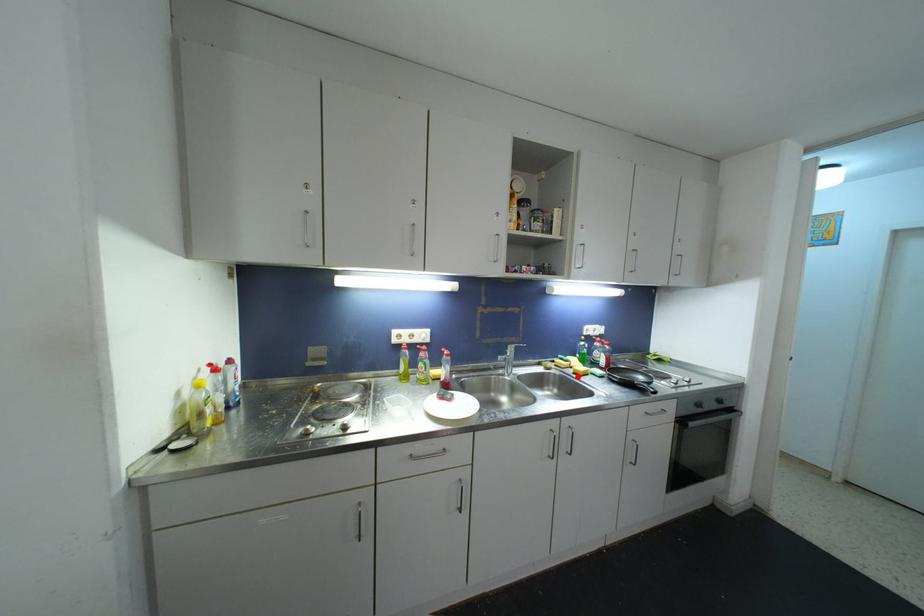
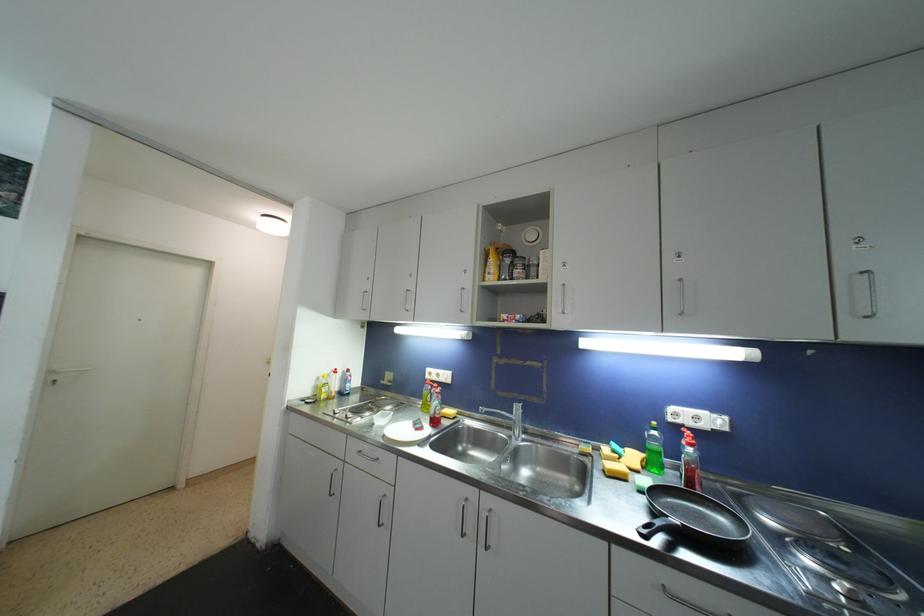
Locate, in the second image, the point that corresponds to the highlighted location in the first image.

(608, 474)